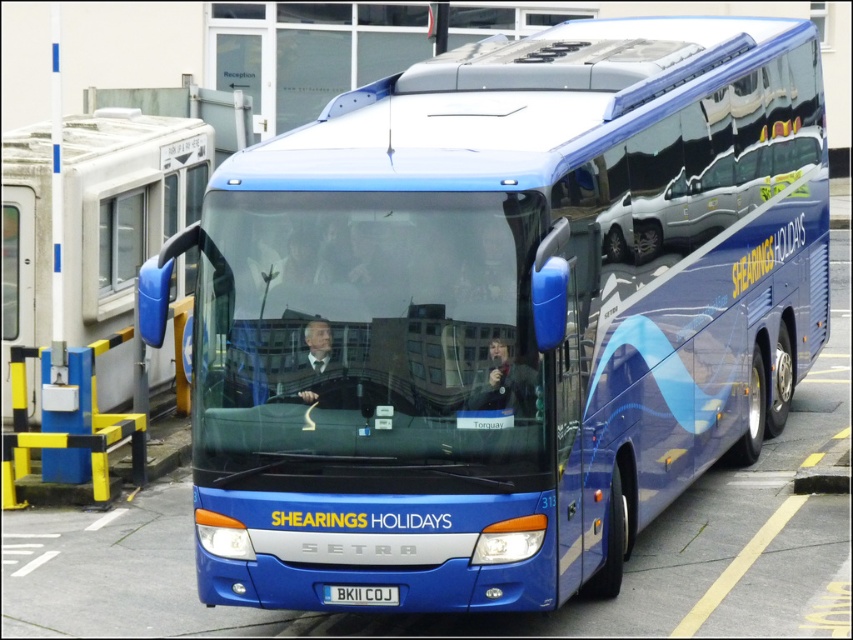
Is dark blue leather jacket at center to the left of smooth skin face at center from the viewer's perspective?

No, dark blue leather jacket at center is not to the left of smooth skin face at center.

Is dark blue leather jacket at center above smooth skin face at center?

Actually, dark blue leather jacket at center is below smooth skin face at center.

The image size is (853, 640). Describe the element at coordinates (503, 385) in the screenshot. I see `dark blue leather jacket at center` at that location.

Where is `dark blue leather jacket at center`? The height and width of the screenshot is (640, 853). dark blue leather jacket at center is located at coordinates (503, 385).

Is point (524, 401) positioned after point (345, 593)?

No, it is not.

Can you confirm if dark blue leather jacket at center is smaller than blue metallic license plate at center?

Incorrect, dark blue leather jacket at center is not smaller in size than blue metallic license plate at center.

Is point (469, 394) farther from camera compared to point (323, 588)?

No, it is in front of (323, 588).

Where is `dark blue leather jacket at center`? The width and height of the screenshot is (853, 640). dark blue leather jacket at center is located at coordinates (503, 385).

Which is in front, point (322, 324) or point (349, 589)?

Point (322, 324)

Between point (329, 364) and point (334, 596), which one is positioned behind?

Positioned behind is point (334, 596).

Which is in front, point (335, 388) or point (326, 596)?

Point (335, 388)

Where is `smooth skin face at center`? This screenshot has height=640, width=853. smooth skin face at center is located at coordinates (315, 364).